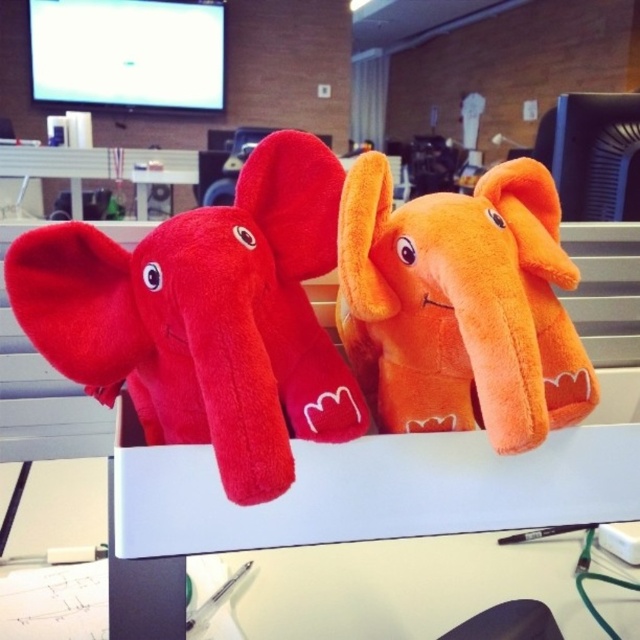
The image size is (640, 640). What do you see at coordinates (205, 317) in the screenshot?
I see `velvety red elephant at center` at bounding box center [205, 317].

Is point (268, 163) less distant than point (484, 180)?

That is True.

Identify the location of velvety red elephant at center. The image size is (640, 640). (205, 317).

Does orange plush elephant at center have a smaller size compared to white plastic computer desk at upper center?

Correct, orange plush elephant at center occupies less space than white plastic computer desk at upper center.

Describe the element at coordinates (461, 307) in the screenshot. I see `orange plush elephant at center` at that location.

Is point (465, 198) behind point (182, 164)?

No.

The image size is (640, 640). I want to click on orange plush elephant at center, so click(461, 307).

Between point (96, 300) and point (196, 157), which one is positioned in front?

Point (96, 300) is more forward.

Is point (141, 374) farther from viewer compared to point (70, 156)?

No.

Describe the element at coordinates (205, 317) in the screenshot. The image size is (640, 640). I see `velvety red elephant at center` at that location.

This screenshot has height=640, width=640. I want to click on velvety red elephant at center, so click(x=205, y=317).